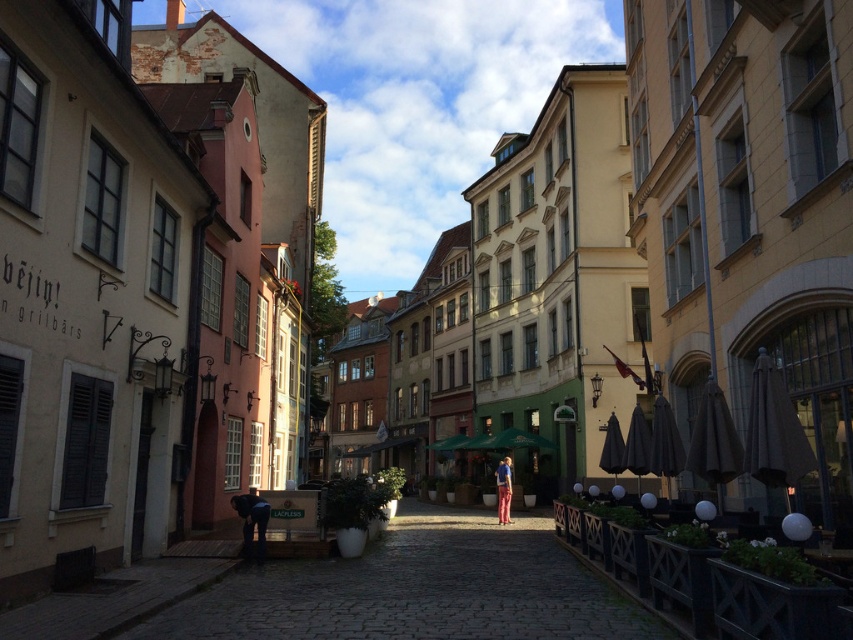
You are a tourist standing on the cobblestone street and see both the matte black jacket at lower left and the blue denim shirt at center. Which one is nearer to you?

The matte black jacket at lower left is closer to the viewer than the blue denim shirt at center.

Consider the image. You are standing at the point labeled point (x=418, y=589) in the image. What object is located exactly at that point?

The point labeled point (x=418, y=589) corresponds to a smooth wooden bench at center.